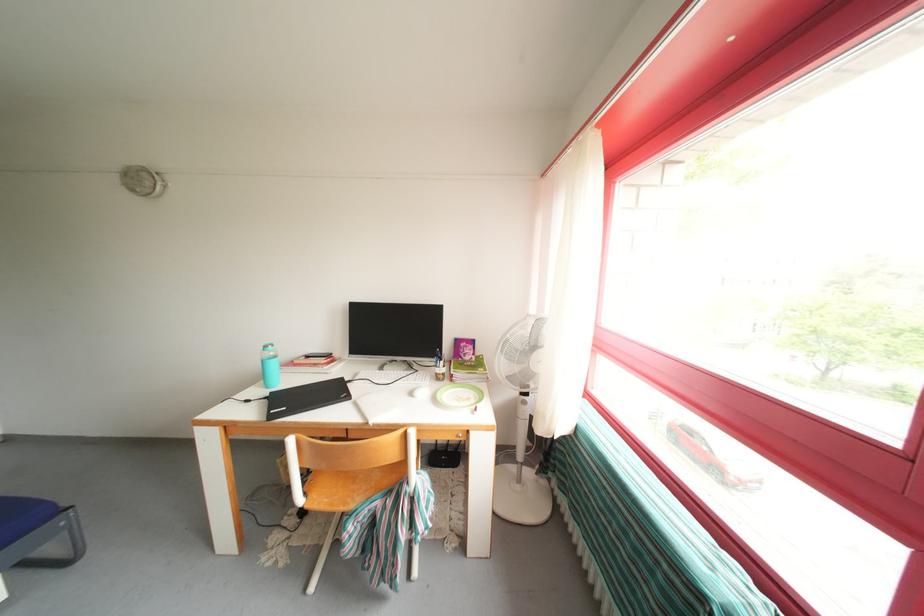
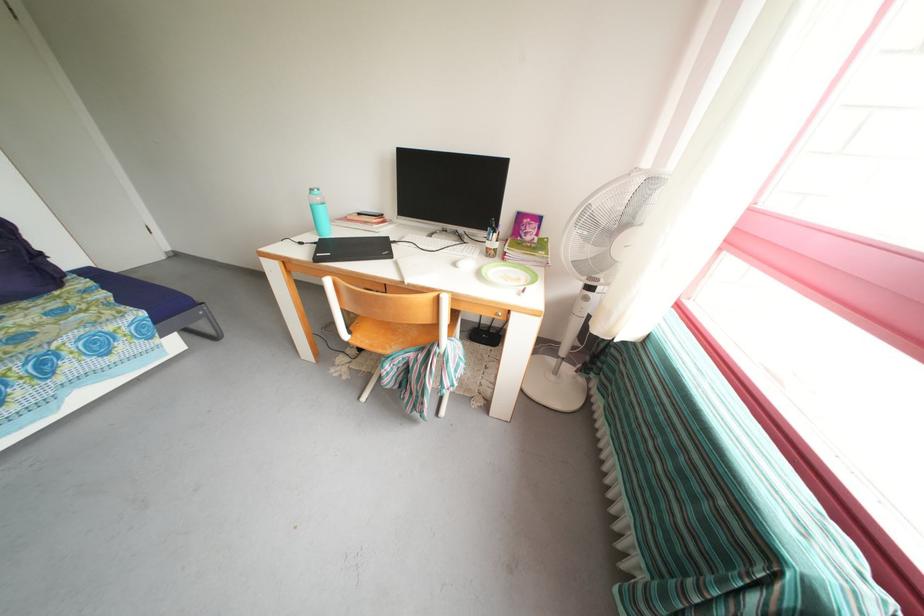
In the second image, find the point that corresponds to pixel 419 399 in the first image.

(462, 269)